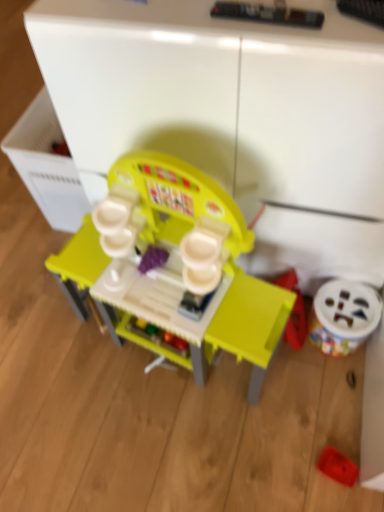
In order to face rubberized red tray at lower right, the second toy from the right, should I rotate leftwards or rightwards?

You should look right and rotate roughly 18.624 degrees.

What do you see at coordinates (174, 264) in the screenshot? This screenshot has width=384, height=512. I see `matte plastic play kitchen at center, the first toy when ordered from left to right` at bounding box center [174, 264].

Where is `rubberized red tray at lower right, the second toy from the right`? The height and width of the screenshot is (512, 384). rubberized red tray at lower right, the second toy from the right is located at coordinates (337, 466).

From the image's perspective, which one is positioned lower, matte plastic play kitchen at center, the first toy when ordered from left to right, or rubberized red tray at lower right, which is the second toy in left-to-right order?

From the image's view, rubberized red tray at lower right, which is the second toy in left-to-right order, is below.

Considering the relative sizes of matte plastic play kitchen at center, the first toy when ordered from left to right, and rubberized red tray at lower right, the second toy from the right, in the image provided, is matte plastic play kitchen at center, the first toy when ordered from left to right, taller than rubberized red tray at lower right, the second toy from the right,?

Correct, matte plastic play kitchen at center, the first toy when ordered from left to right, is much taller as rubberized red tray at lower right, the second toy from the right.

Is matte plastic play kitchen at center, positioned as the 3th toy in right-to-left order, completely or partially outside of rubberized red tray at lower right, the second toy from the right?

Yes, matte plastic play kitchen at center, positioned as the 3th toy in right-to-left order, is located beyond the bounds of rubberized red tray at lower right, the second toy from the right.

Which point is more forward, [231,260] or [346,468]?

The point [231,260] is closer to the camera.

Which of these two, matte plastic play kitchen at center, positioned as the 3th toy in right-to-left order, or white plastic toy at lower right, which appears as the first toy when viewed from the right, stands shorter?

white plastic toy at lower right, which appears as the first toy when viewed from the right, is shorter.

Locate an element on the screen. The width and height of the screenshot is (384, 512). the 1st toy below the matte plastic play kitchen at center, positioned as the 3th toy in right-to-left order (from a real-world perspective) is located at coordinates (343, 316).

Considering the points (145, 200) and (351, 329), which point is in front, point (145, 200) or point (351, 329)?

Point (145, 200)

Is matte plastic play kitchen at center, positioned as the 3th toy in right-to-left order, aimed at white plastic toy at lower right, the third toy when ordered from left to right?

No, matte plastic play kitchen at center, positioned as the 3th toy in right-to-left order, is not aimed at white plastic toy at lower right, the third toy when ordered from left to right.

Find the location of `drawer behind the rubberized red tray at lower right, the second toy from the right`. drawer behind the rubberized red tray at lower right, the second toy from the right is located at coordinates (46, 165).

Are white plastic drawer at left and rubberized red tray at lower right, which is the second toy in left-to-right order, far apart?

Yes, white plastic drawer at left and rubberized red tray at lower right, which is the second toy in left-to-right order, are quite far apart.

Is white plastic drawer at left wider or thinner than rubberized red tray at lower right, the second toy from the right?

In the image, white plastic drawer at left appears to be wider than rubberized red tray at lower right, the second toy from the right.

Is white plastic drawer at left inside or outside of rubberized red tray at lower right, the second toy from the right?

white plastic drawer at left cannot be found inside rubberized red tray at lower right, the second toy from the right.

From the image's perspective, is matte plastic play kitchen at center, positioned as the 3th toy in right-to-left order, over white plastic drawer at left?

Actually, matte plastic play kitchen at center, positioned as the 3th toy in right-to-left order, appears below white plastic drawer at left in the image.

Is matte plastic play kitchen at center, the first toy when ordered from left to right, beside white plastic drawer at left?

matte plastic play kitchen at center, the first toy when ordered from left to right, and white plastic drawer at left are not in contact.

Image resolution: width=384 pixels, height=512 pixels. I want to click on drawer above the matte plastic play kitchen at center, the first toy when ordered from left to right (from the image's perspective), so click(46, 165).

Identify the location of toy that is the 1st one when counting leftward from the white plastic toy at lower right, the third toy when ordered from left to right. (337, 466).

Is white plastic toy at lower right, which appears as the first toy when viewed from the right, positioned far away from rubberized red tray at lower right, the second toy from the right?

white plastic toy at lower right, which appears as the first toy when viewed from the right, is near rubberized red tray at lower right, the second toy from the right, not far away.

Which is less distant, (325, 306) or (353, 466)?

The point (353, 466) is closer.

Between white plastic toy at lower right, which appears as the first toy when viewed from the right, and rubberized red tray at lower right, which is the second toy in left-to-right order, which one has larger width?

white plastic toy at lower right, which appears as the first toy when viewed from the right, is wider.

Between rubberized red tray at lower right, the second toy from the right, and white plastic drawer at left, which one appears on the left side from the viewer's perspective?

white plastic drawer at left is more to the left.

Considering the sizes of objects rubberized red tray at lower right, the second toy from the right, and white plastic drawer at left in the image provided, who is bigger, rubberized red tray at lower right, the second toy from the right, or white plastic drawer at left?

With larger size is white plastic drawer at left.

Is rubberized red tray at lower right, the second toy from the right, beside white plastic drawer at left?

No, rubberized red tray at lower right, the second toy from the right, is not in contact with white plastic drawer at left.

Which of these two, white plastic toy at lower right, which appears as the first toy when viewed from the right, or white plastic drawer at left, is bigger?

white plastic drawer at left is bigger.

Which toy is the 3rd one when counting from the right side of the white plastic drawer at left? Please provide its 2D coordinates.

[(343, 316)]

Considering the relative sizes of white plastic toy at lower right, which appears as the first toy when viewed from the right, and white plastic drawer at left in the image provided, is white plastic toy at lower right, which appears as the first toy when viewed from the right, taller than white plastic drawer at left?

In fact, white plastic toy at lower right, which appears as the first toy when viewed from the right, may be shorter than white plastic drawer at left.

Considering the points (358, 283) and (42, 155), which point is in front, point (358, 283) or point (42, 155)?

Point (358, 283)

Where is `the 2nd toy below when counting from the matte plastic play kitchen at center, the first toy when ordered from left to right (from the image's perspective)`? This screenshot has width=384, height=512. the 2nd toy below when counting from the matte plastic play kitchen at center, the first toy when ordered from left to right (from the image's perspective) is located at coordinates coord(337,466).

Locate an element on the screen. The width and height of the screenshot is (384, 512). toy that is the 2nd object to the right of the matte plastic play kitchen at center, the first toy when ordered from left to right, starting at the anchor is located at coordinates (343, 316).

Considering their positions, is white plastic drawer at left positioned closer to matte plastic play kitchen at center, positioned as the 3th toy in right-to-left order, than white plastic toy at lower right, which appears as the first toy when viewed from the right?

white plastic drawer at left is closer to matte plastic play kitchen at center, positioned as the 3th toy in right-to-left order.

Estimate the real-world distances between objects in this image. Which object is further from white plastic toy at lower right, which appears as the first toy when viewed from the right, rubberized red tray at lower right, which is the second toy in left-to-right order, or white plastic drawer at left?

Based on the image, white plastic drawer at left appears to be further to white plastic toy at lower right, which appears as the first toy when viewed from the right.

Looking at this image, when comparing their distances from white plastic drawer at left, does matte plastic play kitchen at center, the first toy when ordered from left to right, or white plastic toy at lower right, which appears as the first toy when viewed from the right, seem further?

Among the two, white plastic toy at lower right, which appears as the first toy when viewed from the right, is located further to white plastic drawer at left.

From the image, which object appears to be farther from rubberized red tray at lower right, the second toy from the right, white plastic toy at lower right, which appears as the first toy when viewed from the right, or white plastic drawer at left?

Based on the image, white plastic drawer at left appears to be further to rubberized red tray at lower right, the second toy from the right.

Based on the photo, considering their positions, is matte plastic play kitchen at center, positioned as the 3th toy in right-to-left order, positioned further to rubberized red tray at lower right, the second toy from the right, than white plastic drawer at left?

The object further to rubberized red tray at lower right, the second toy from the right, is white plastic drawer at left.

Based on their spatial positions, is white plastic drawer at left or matte plastic play kitchen at center, positioned as the 3th toy in right-to-left order, closer to white plastic toy at lower right, the third toy when ordered from left to right?

matte plastic play kitchen at center, positioned as the 3th toy in right-to-left order, lies closer to white plastic toy at lower right, the third toy when ordered from left to right, than the other object.

Which object lies nearer to the anchor point white plastic drawer at left, white plastic toy at lower right, which appears as the first toy when viewed from the right, or matte plastic play kitchen at center, the first toy when ordered from left to right?

Based on the image, matte plastic play kitchen at center, the first toy when ordered from left to right, appears to be nearer to white plastic drawer at left.

Looking at the image, which one is located further to white plastic drawer at left, matte plastic play kitchen at center, positioned as the 3th toy in right-to-left order, or rubberized red tray at lower right, which is the second toy in left-to-right order?

The object further to white plastic drawer at left is rubberized red tray at lower right, which is the second toy in left-to-right order.

The image size is (384, 512). What are the coordinates of `toy located between matte plastic play kitchen at center, positioned as the 3th toy in right-to-left order, and white plastic toy at lower right, which appears as the first toy when viewed from the right, in the left-right direction` in the screenshot? It's located at (337, 466).